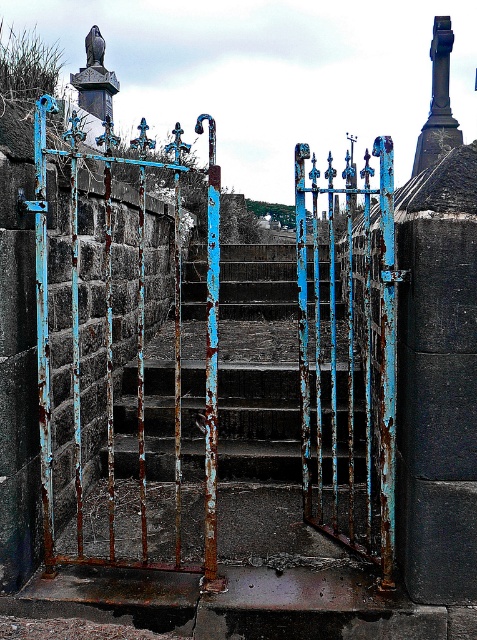
Can you confirm if rusty metal gate at center is taller than rusty metal stairs at center?

Yes.

In the scene shown: Who is more distant from viewer, (x=213, y=300) or (x=131, y=372)?

The point (x=131, y=372) is more distant.

Find the location of `rusty metal gate at center`. rusty metal gate at center is located at coordinates (346, 381).